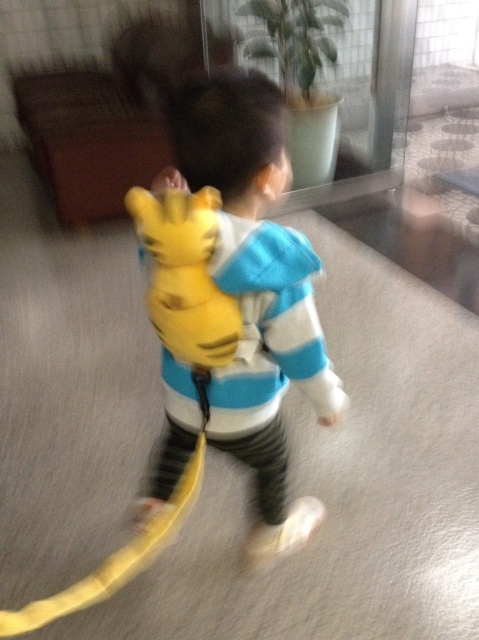
You are helping a child organize their belongings. You see a yellow plush backpack at center and a yellow plush toy at back. Which item should you place on a smaller shelf to ensure it fits properly?

The yellow plush toy at back should be placed on the smaller shelf since it is smaller than the yellow plush backpack at center.

You are helping a child organize their belongings in the living room. You see the yellow plush backpack at center and the yellow plush toy at back. Which item should you place on the higher shelf to accommodate its size?

The yellow plush backpack at center is taller than the yellow plush toy at back, so it should be placed on the higher shelf to accommodate its size.